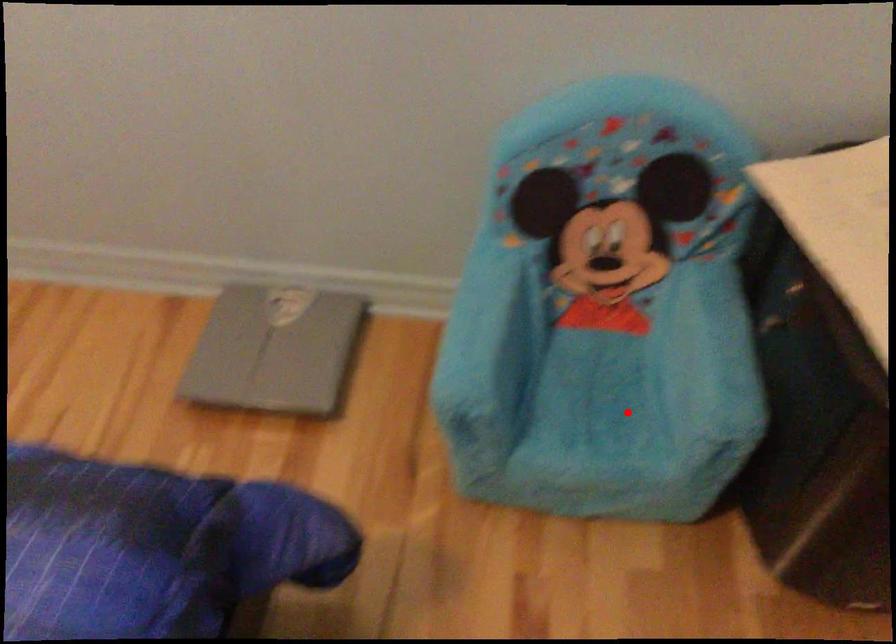
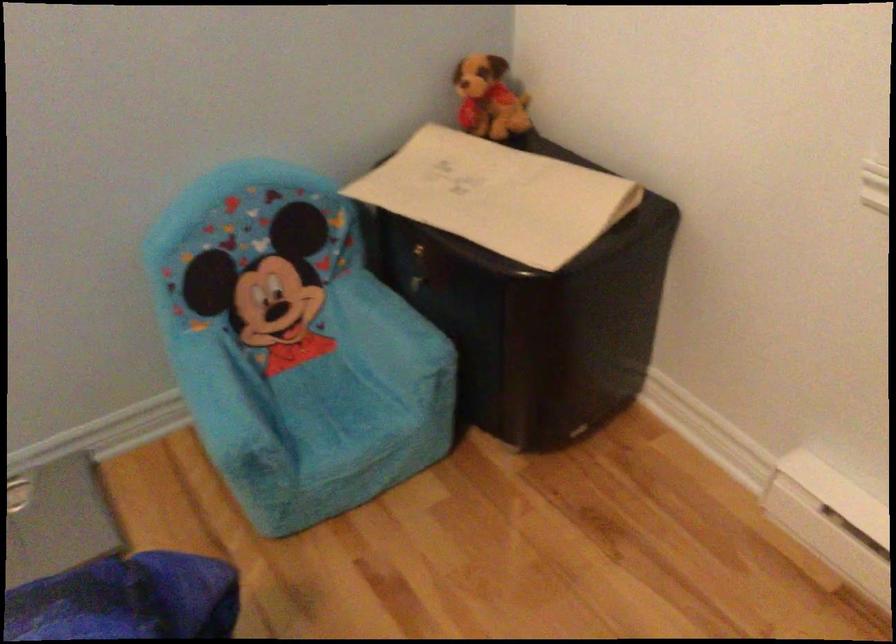
The point at the highlighted location is marked in the first image. Where is the corresponding point in the second image?

(364, 402)